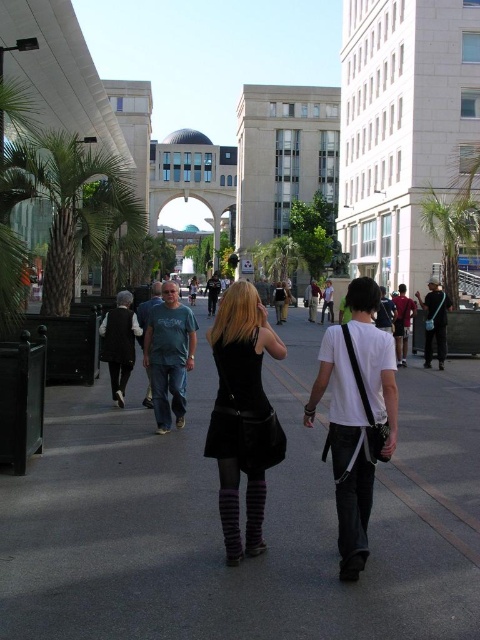
Is black leather skirt at center taller than green leafy palm tree at right?

Answer: In fact, black leather skirt at center may be shorter than green leafy palm tree at right.

Between point (228, 344) and point (444, 220), which one is positioned in front?

Point (228, 344)

Locate an element on the screen. black leather skirt at center is located at coordinates (242, 413).

Is smooth asphalt pavement at center to the right of green leafy palm tree at right from the viewer's perspective?

In fact, smooth asphalt pavement at center is to the left of green leafy palm tree at right.

Who is more forward, (194, 394) or (423, 218)?

Point (194, 394) is in front.

Does point (28, 600) lie in front of point (479, 214)?

Yes.

Where is `smooth asphalt pavement at center`? This screenshot has width=480, height=640. smooth asphalt pavement at center is located at coordinates (218, 522).

Who is higher up, smooth asphalt pavement at center or black leather skirt at center?

black leather skirt at center is above.

Who is more forward, (472, 611) or (225, 428)?

Point (472, 611) is in front.

Does point (180, 524) come closer to viewer compared to point (228, 368)?

No, it is not.

You are a GUI agent. You are given a task and a screenshot of the screen. Output one action in this format:
    pyautogui.click(x=<x>, y=<y>)
    Task: Click on the smooth asphalt pavement at center
    The width and height of the screenshot is (480, 640).
    Given the screenshot: What is the action you would take?
    pyautogui.click(x=218, y=522)